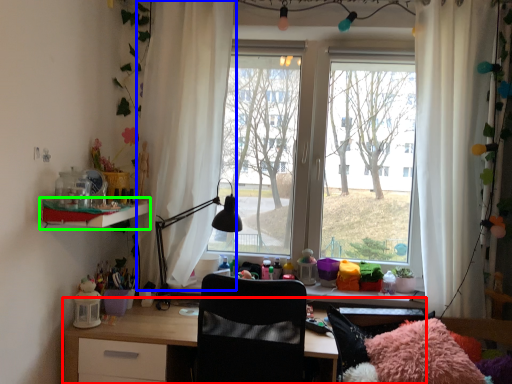
Question: Which object is the closest to the desk (highlighted by a red box)? Choose among these: curtain (highlighted by a blue box) or shelf (highlighted by a green box).

Choices:
 (A) curtain
 (B) shelf

Answer: (B)